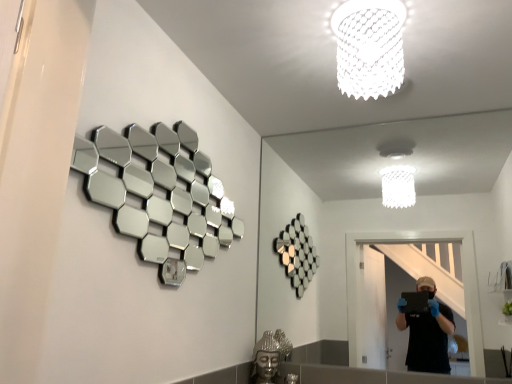
At what (x,y) coordinates should I click in order to perform the action: click on silver reflective hexagonal mirrors at upper left, the first mirror when ordered from left to right. Please return your answer as a coordinate pair (x, y). Looking at the image, I should click on (160, 194).

Measure the distance between point (x=122, y=191) and camera.

Point (x=122, y=191) is 1.50 meters away from camera.

Identify the location of clear glass mirror at center, which is the second mirror in left-to-right order. Image resolution: width=512 pixels, height=384 pixels. (377, 208).

Image resolution: width=512 pixels, height=384 pixels. I want to click on silver metallic buddha head at lower center, so coord(270,356).

The image size is (512, 384). Describe the element at coordinates (369, 47) in the screenshot. I see `white textured lampshade at upper center` at that location.

Locate an element on the screen. The image size is (512, 384). silver reflective hexagonal mirrors at upper left, which is the second mirror from right to left is located at coordinates (160, 194).

Is silver metallic buddha head at lower center at the right side of clear glass mirror at center, which ranks as the 1th mirror in right-to-left order?

In fact, silver metallic buddha head at lower center is to the left of clear glass mirror at center, which ranks as the 1th mirror in right-to-left order.

Identify the location of reflection to the left of clear glass mirror at center, which ranks as the 1th mirror in right-to-left order. This screenshot has height=384, width=512. (270, 356).

Is silver metallic buddha head at lower center not close to clear glass mirror at center, which ranks as the 1th mirror in right-to-left order?

Yes.

Consider the image. Would you say clear glass mirror at center, which ranks as the 1th mirror in right-to-left order, contains silver metallic buddha head at lower center?

That's incorrect, silver metallic buddha head at lower center is not inside clear glass mirror at center, which ranks as the 1th mirror in right-to-left order.

Identify the location of mirror that is the 1st one when counting upward from the silver metallic buddha head at lower center (from the image's perspective). Image resolution: width=512 pixels, height=384 pixels. (377, 208).

Does clear glass mirror at center, which ranks as the 1th mirror in right-to-left order, have a lesser width compared to silver metallic buddha head at lower center?

Correct, the width of clear glass mirror at center, which ranks as the 1th mirror in right-to-left order, is less than that of silver metallic buddha head at lower center.

Is clear glass mirror at center, which is the second mirror in left-to-right order, to the left or to the right of white textured lampshade at upper center in the image?

Based on their positions, clear glass mirror at center, which is the second mirror in left-to-right order, is located to the right of white textured lampshade at upper center.

Which point is more distant from viewer, (464, 198) or (372, 5)?

The point (464, 198) is behind.

Is clear glass mirror at center, which ranks as the 1th mirror in right-to-left order, not near white textured lampshade at upper center?

Indeed, clear glass mirror at center, which ranks as the 1th mirror in right-to-left order, is not near white textured lampshade at upper center.

Between silver reflective hexagonal mirrors at upper left, the first mirror when ordered from left to right, and white textured lampshade at upper center, which one is positioned behind?

white textured lampshade at upper center is more distant.

Is silver reflective hexagonal mirrors at upper left, the first mirror when ordered from left to right, taller than white textured lampshade at upper center?

Yes.

Which of these two, silver reflective hexagonal mirrors at upper left, the first mirror when ordered from left to right, or white textured lampshade at upper center, is thinner?

With smaller width is silver reflective hexagonal mirrors at upper left, the first mirror when ordered from left to right.

Is silver reflective hexagonal mirrors at upper left, which is the second mirror from right to left, aimed at white textured lampshade at upper center?

Yes.

Looking at this image, considering the relative sizes of silver reflective hexagonal mirrors at upper left, which is the second mirror from right to left, and silver metallic buddha head at lower center in the image provided, is silver reflective hexagonal mirrors at upper left, which is the second mirror from right to left, smaller than silver metallic buddha head at lower center?

No, silver reflective hexagonal mirrors at upper left, which is the second mirror from right to left, is not smaller than silver metallic buddha head at lower center.

Is the surface of silver reflective hexagonal mirrors at upper left, the first mirror when ordered from left to right, in direct contact with silver metallic buddha head at lower center?

No.

From the image's perspective, relative to silver metallic buddha head at lower center, is silver reflective hexagonal mirrors at upper left, which is the second mirror from right to left, above or below?

Based on their image positions, silver reflective hexagonal mirrors at upper left, which is the second mirror from right to left, is located above silver metallic buddha head at lower center.

From a real-world perspective, does silver reflective hexagonal mirrors at upper left, which is the second mirror from right to left, stand above silver metallic buddha head at lower center?

Correct, in the physical world, silver reflective hexagonal mirrors at upper left, which is the second mirror from right to left, is higher than silver metallic buddha head at lower center.

From the picture: From the image's perspective, who appears lower, silver metallic buddha head at lower center or white textured lampshade at upper center?

silver metallic buddha head at lower center appears lower in the image.

Which is correct: silver metallic buddha head at lower center is inside white textured lampshade at upper center, or outside of it?

silver metallic buddha head at lower center is not inside white textured lampshade at upper center, it's outside.

In the image, there is a white textured lampshade at upper center. Where is `reflection below it (from the image's perspective)`? reflection below it (from the image's perspective) is located at coordinates (270, 356).

Which of these two, silver metallic buddha head at lower center or white textured lampshade at upper center, stands taller?

Standing taller between the two is silver metallic buddha head at lower center.

From a real-world perspective, between white textured lampshade at upper center and silver reflective hexagonal mirrors at upper left, which is the second mirror from right to left, who is vertically lower?

From a 3D spatial view, silver reflective hexagonal mirrors at upper left, which is the second mirror from right to left, is below.

Does white textured lampshade at upper center lie in front of silver reflective hexagonal mirrors at upper left, which is the second mirror from right to left?

No.

Based on the photo, is white textured lampshade at upper center looking in the opposite direction of silver reflective hexagonal mirrors at upper left, the first mirror when ordered from left to right?

white textured lampshade at upper center is not turned away from silver reflective hexagonal mirrors at upper left, the first mirror when ordered from left to right.

The width and height of the screenshot is (512, 384). I want to click on reflection located on the left of clear glass mirror at center, which ranks as the 1th mirror in right-to-left order, so click(x=270, y=356).

The height and width of the screenshot is (384, 512). In the image, there is a clear glass mirror at center, which is the second mirror in left-to-right order. What are the coordinates of `reflection below it (from a real-world perspective)` in the screenshot? It's located at (270, 356).

Estimate the real-world distances between objects in this image. Which object is closer to clear glass mirror at center, which ranks as the 1th mirror in right-to-left order, silver metallic buddha head at lower center or white textured lampshade at upper center?

silver metallic buddha head at lower center.

When comparing their distances from clear glass mirror at center, which ranks as the 1th mirror in right-to-left order, does white textured lampshade at upper center or silver metallic buddha head at lower center seem closer?

silver metallic buddha head at lower center is closer to clear glass mirror at center, which ranks as the 1th mirror in right-to-left order.

Based on their spatial positions, is silver metallic buddha head at lower center or silver reflective hexagonal mirrors at upper left, the first mirror when ordered from left to right, closer to clear glass mirror at center, which ranks as the 1th mirror in right-to-left order?

silver metallic buddha head at lower center.

Based on their spatial positions, is white textured lampshade at upper center or clear glass mirror at center, which is the second mirror in left-to-right order, further from silver metallic buddha head at lower center?

white textured lampshade at upper center.

Estimate the real-world distances between objects in this image. Which object is further from clear glass mirror at center, which ranks as the 1th mirror in right-to-left order, white textured lampshade at upper center or silver reflective hexagonal mirrors at upper left, the first mirror when ordered from left to right?

Among the two, white textured lampshade at upper center is located further to clear glass mirror at center, which ranks as the 1th mirror in right-to-left order.

Considering their positions, is clear glass mirror at center, which ranks as the 1th mirror in right-to-left order, positioned closer to silver reflective hexagonal mirrors at upper left, the first mirror when ordered from left to right, than white textured lampshade at upper center?

white textured lampshade at upper center lies closer to silver reflective hexagonal mirrors at upper left, the first mirror when ordered from left to right, than the other object.

Based on their spatial positions, is silver metallic buddha head at lower center or clear glass mirror at center, which is the second mirror in left-to-right order, further from white textured lampshade at upper center?

clear glass mirror at center, which is the second mirror in left-to-right order, lies further to white textured lampshade at upper center than the other object.

Which object lies further to the anchor point silver reflective hexagonal mirrors at upper left, which is the second mirror from right to left, clear glass mirror at center, which ranks as the 1th mirror in right-to-left order, or silver metallic buddha head at lower center?

clear glass mirror at center, which ranks as the 1th mirror in right-to-left order, is further to silver reflective hexagonal mirrors at upper left, which is the second mirror from right to left.

Locate an element on the screen. The width and height of the screenshot is (512, 384). lamp between silver reflective hexagonal mirrors at upper left, which is the second mirror from right to left, and clear glass mirror at center, which is the second mirror in left-to-right order, in the horizontal direction is located at coordinates (369, 47).

Find the location of a particular element. This screenshot has height=384, width=512. mirror between silver reflective hexagonal mirrors at upper left, which is the second mirror from right to left, and silver metallic buddha head at lower center, along the z-axis is located at coordinates (377, 208).